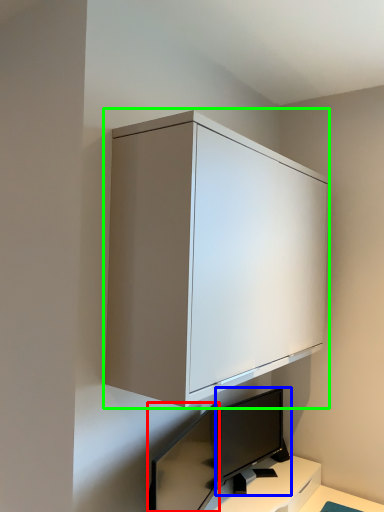
Question: Based on their relative distances, which object is nearer to computer monitor (highlighted by a red box)? Choose from computer monitor (highlighted by a blue box) and cabinetry (highlighted by a green box).

Choices:
 (A) computer monitor
 (B) cabinetry

Answer: (A)